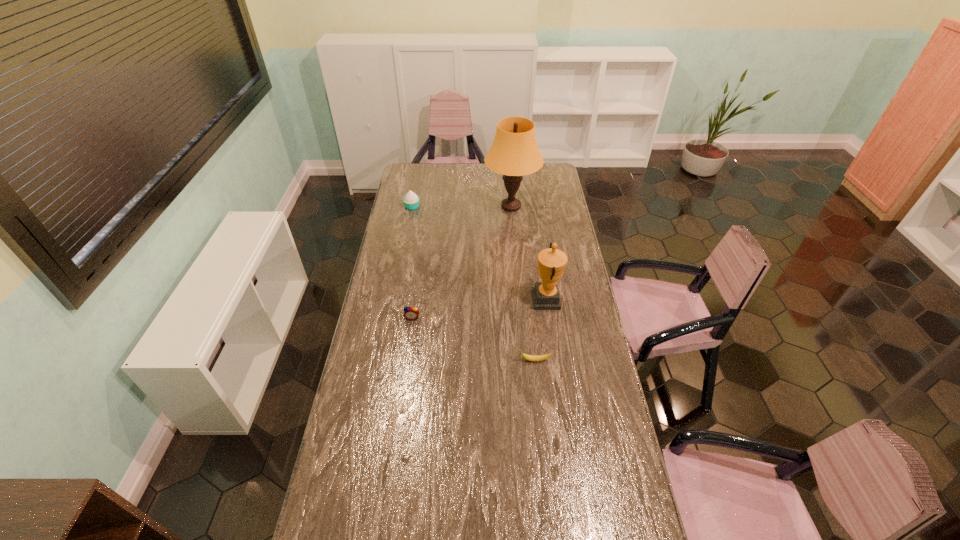
At what (x,y) coordinates should I click in order to perform the action: click on lampshade that is at the right edge. Please return your answer as a coordinate pair (x, y). Looking at the image, I should click on (514, 152).

Locate an element on the screen. The width and height of the screenshot is (960, 540). award situated at the right edge is located at coordinates (551, 262).

The height and width of the screenshot is (540, 960). In order to click on free space at the far edge of the desktop in this screenshot , I will do `click(484, 163)`.

Find the location of a particular element. free region at the left edge of the desktop is located at coordinates (407, 252).

In the image, there is a desktop. Where is `vacant area at the right edge`? vacant area at the right edge is located at coordinates (555, 191).

Where is `vacant area that lies between the second tallest object and the cupcake`? This screenshot has width=960, height=540. vacant area that lies between the second tallest object and the cupcake is located at coordinates (479, 253).

Identify the location of vacant area that lies between the tallest object and the third shortest object. (462, 206).

Locate an element on the screen. free spot between the fourth tallest object and the banana is located at coordinates (473, 339).

Find the location of `vacant space in between the second tallest object and the third shortest object`. vacant space in between the second tallest object and the third shortest object is located at coordinates (479, 253).

Locate an element on the screen. This screenshot has height=540, width=960. vacant point located between the nearest object and the award is located at coordinates (540, 329).